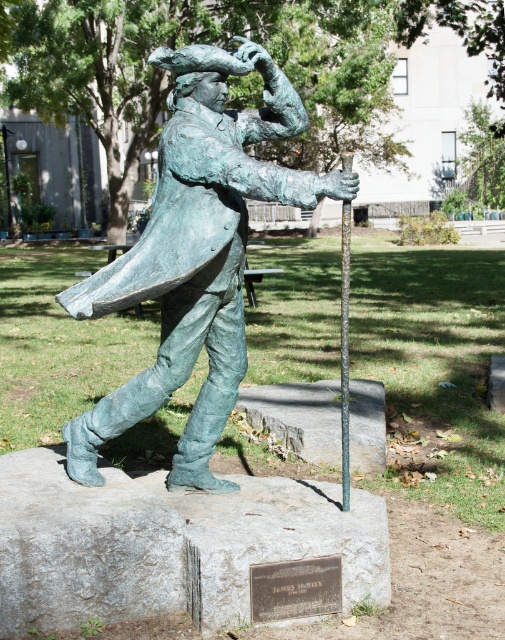
What do you see at coordinates (195, 256) in the screenshot? I see `green patina bronze statue at center` at bounding box center [195, 256].

This screenshot has height=640, width=505. What are the coordinates of `green patina bronze statue at center` in the screenshot? It's located at (195, 256).